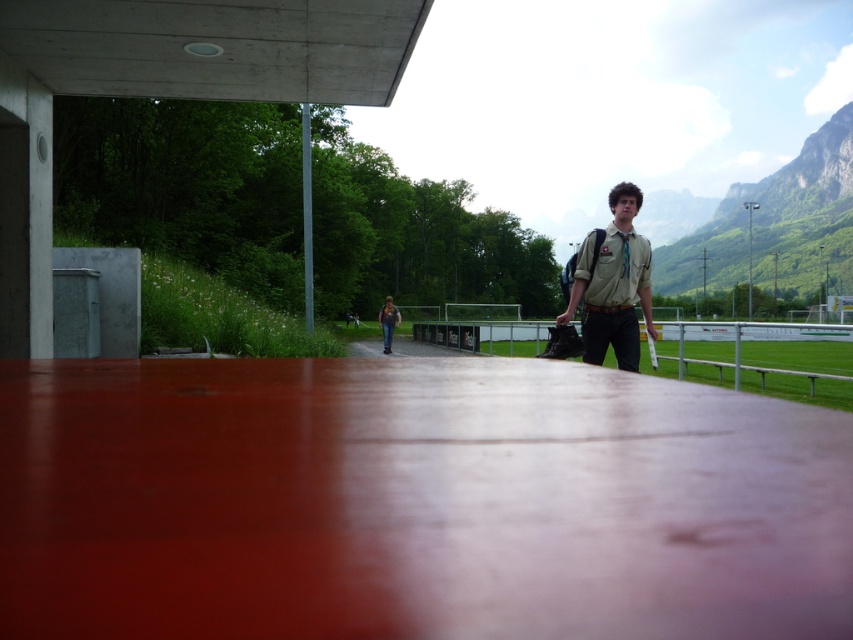
You are standing at the lower left corner of the image. You want to walk to the metallic silver rail at center. Which direction should you move first?

You should move to the right first to reach the metallic silver rail at center.

You are a photographer trying to capture a photo of the khaki fabric shirt at center and the metallic silver rail at center. Which object should you focus on first if you want to ensure both are in focus without adjusting the camera settings?

You should focus on the khaki fabric shirt at center first because it is closer to the viewer than the metallic silver rail at center. By focusing on the closer object, the farther object will also be in focus due to the depth of field.